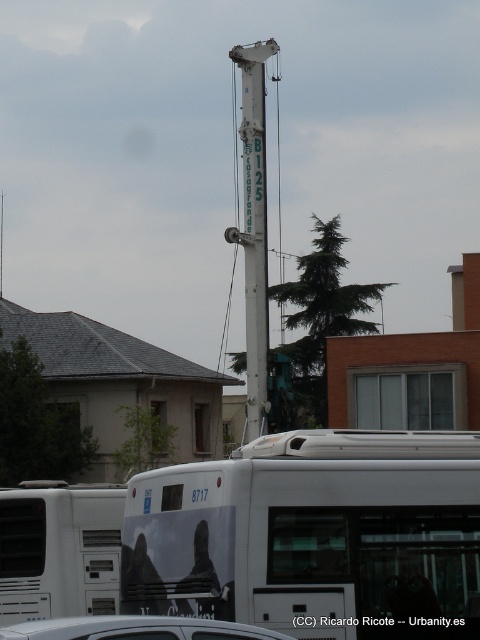
You are a delivery person who needs to park your 2.5 meter wide delivery van between the white painted metal pole at center and the silver metallic car at lower center. Can you fit your van there?

The distance between the white painted metal pole at center and the silver metallic car at lower center is 11.49 meters. Since your van is only 2.5 meters wide, there is sufficient space to park it between them.

You are a delivery person who needs to park your 2.5 meter tall truck. You see the white painted metal pole at center and the silver metallic car at lower center in the parking lot. Which object will block the truck from passing through if the truck is 2.5 meters tall?

The white painted metal pole at center has a greater height compared to the silver metallic car at lower center, so the white painted metal pole at center will block the truck from passing through because it is taller than the truck.